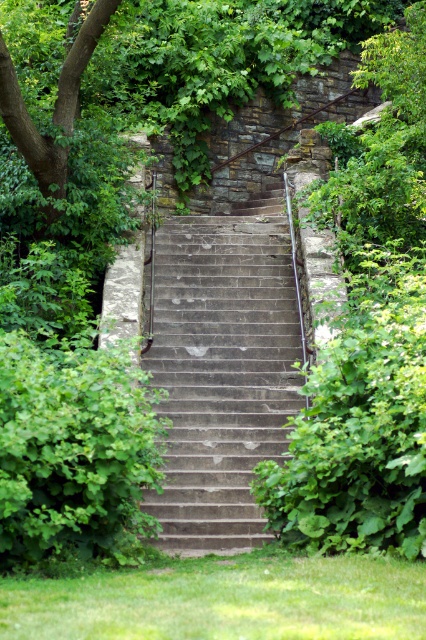
Question: Is gray concrete stairs at center to the left of green leafy tree at upper left from the viewer's perspective?

Choices:
 (A) yes
 (B) no

Answer: (B)

Question: Can you confirm if gray concrete stairs at center is smaller than green leafy tree at upper left?

Choices:
 (A) yes
 (B) no

Answer: (B)

Question: Which of the following is the farthest from the observer?

Choices:
 (A) gray concrete stairs at center
 (B) green leafy tree at upper left

Answer: (B)

Question: Does gray concrete stairs at center appear on the left side of green leafy tree at upper left?

Choices:
 (A) yes
 (B) no

Answer: (B)